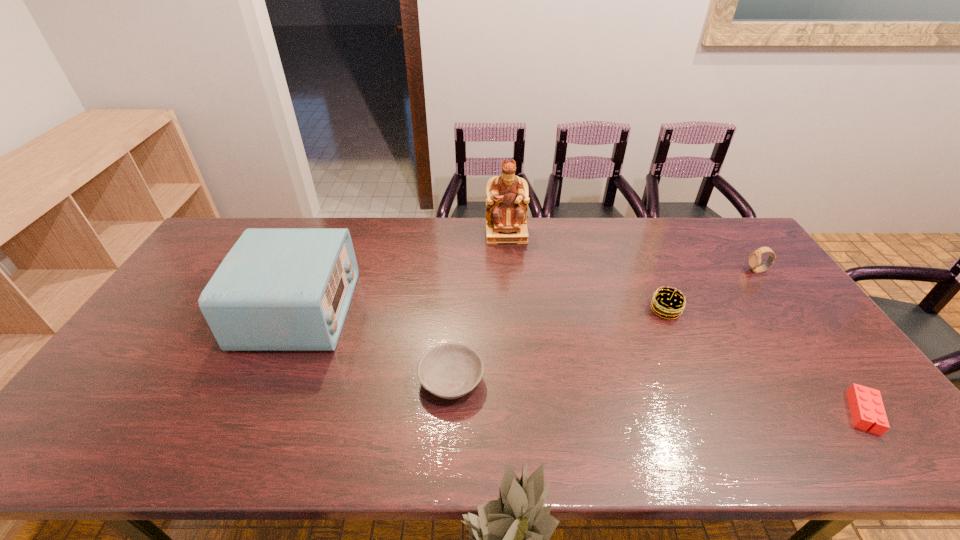
Where is `the fourth object from right to left`? The width and height of the screenshot is (960, 540). the fourth object from right to left is located at coordinates (507, 200).

Identify the location of the tallest object. (507, 200).

I want to click on the leftmost object, so click(278, 289).

I want to click on the second tallest object, so click(x=278, y=289).

You are a GUI agent. You are given a task and a screenshot of the screen. Output one action in this format:
    pyautogui.click(x=<x>, y=<y>)
    Task: Click on the watch
    The width and height of the screenshot is (960, 540).
    Given the screenshot: What is the action you would take?
    pyautogui.click(x=754, y=260)

Find the location of a particular element. Image resolution: width=960 pixels, height=540 pixels. the third shortest object is located at coordinates (669, 302).

The width and height of the screenshot is (960, 540). I want to click on patty, so click(x=669, y=302).

The height and width of the screenshot is (540, 960). In order to click on bowl in this screenshot , I will do `click(451, 370)`.

Identify the location of the fifth tallest object. The width and height of the screenshot is (960, 540). (451, 370).

This screenshot has height=540, width=960. I want to click on Lego, so click(866, 405).